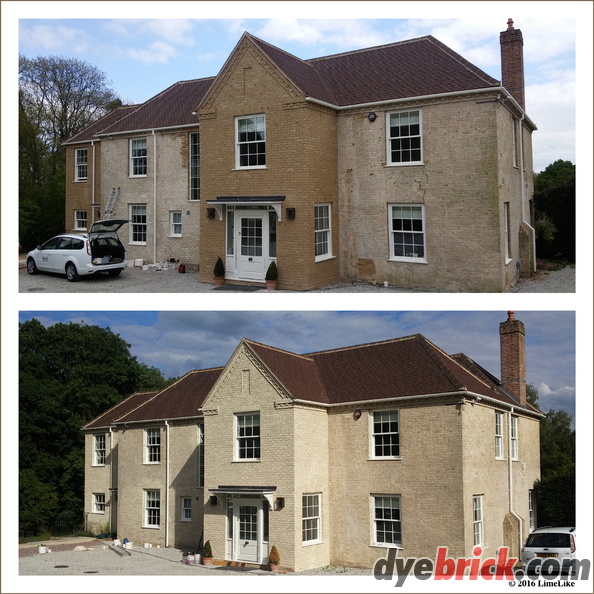
Locate an element on the screen. The image size is (594, 594). potted plants is located at coordinates (217, 264), (266, 276), (202, 549), (265, 558).